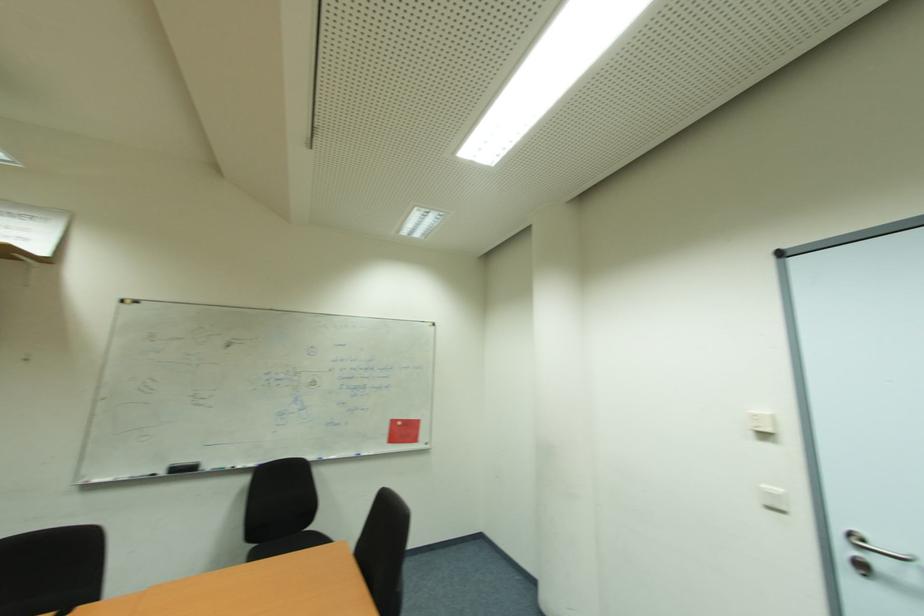
What do you see at coordinates (873, 561) in the screenshot?
I see `the silver door handle` at bounding box center [873, 561].